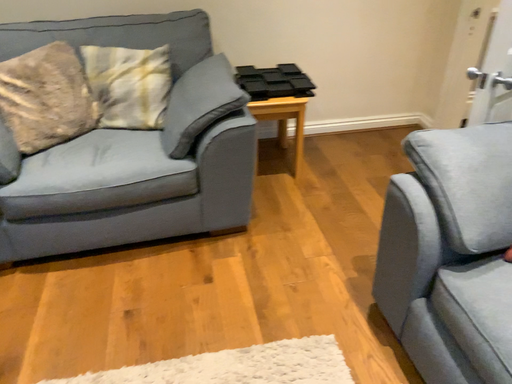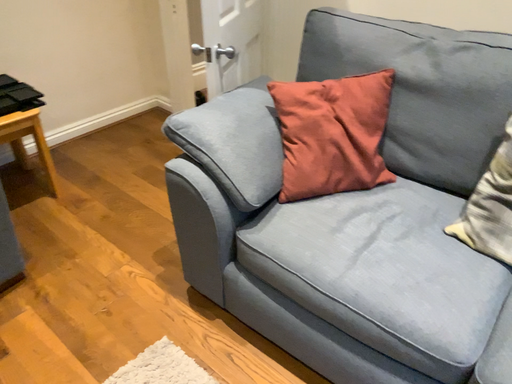
Question: Which way did the camera rotate in the video?

Choices:
 (A) rotated left
 (B) rotated right

Answer: (B)